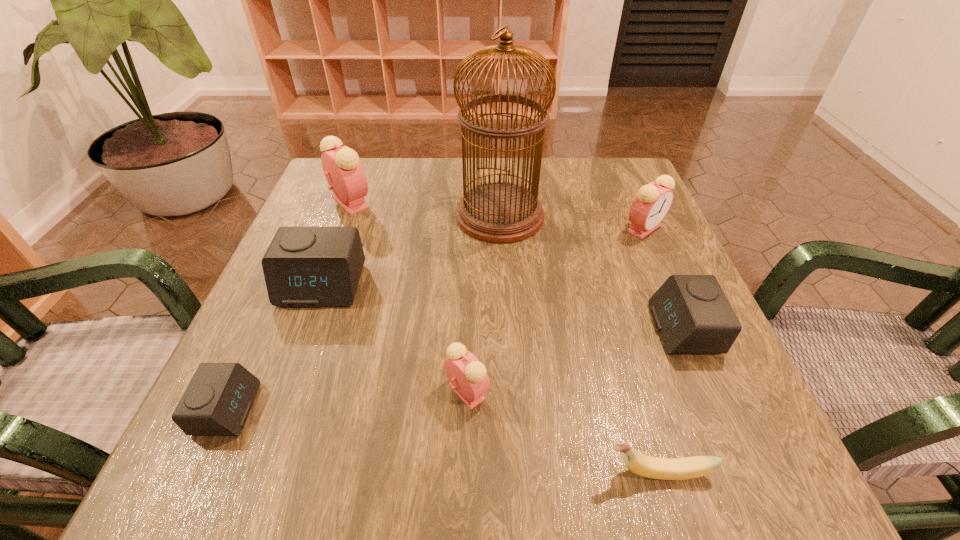
Where is `free space that satisfies the following two spatial constraints: 1. on the face of the fifth shortest alarm clock; 2. on the front-facing side of the rightmost black alarm clock`? The width and height of the screenshot is (960, 540). free space that satisfies the following two spatial constraints: 1. on the face of the fifth shortest alarm clock; 2. on the front-facing side of the rightmost black alarm clock is located at coordinates (687, 329).